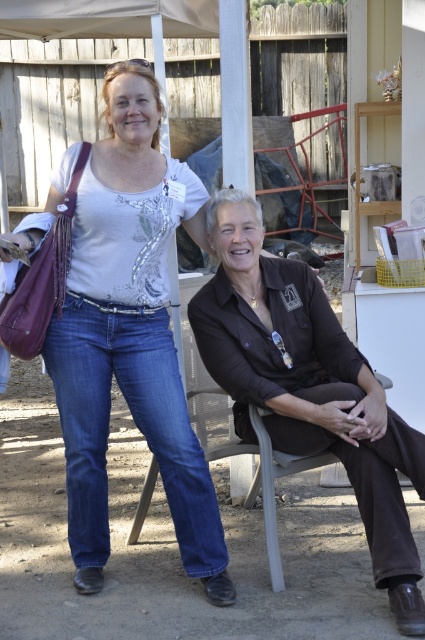
You are a photographer at the event and want to ensure both subjects are in focus. Since the denim jeans at left and brown matte shirt at center are at different heights, which one is taller?

The denim jeans at left is taller than the brown matte shirt at center according to the description.